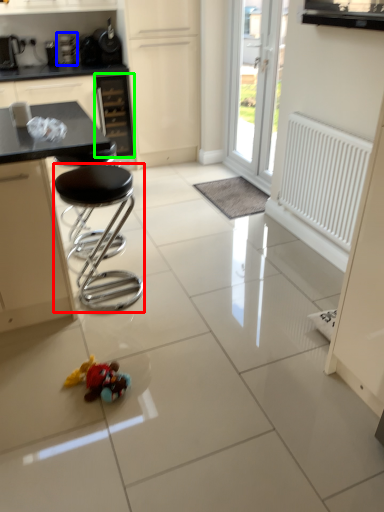
Question: Which is nearer to the stool (highlighted by a red box)? appliance (highlighted by a blue box) or drawer (highlighted by a green box).

Choices:
 (A) appliance
 (B) drawer

Answer: (B)